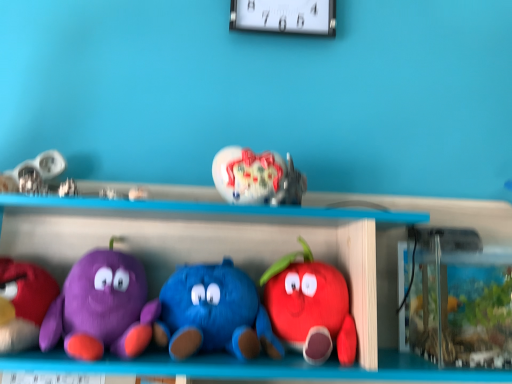
Question: Is purple plush toy at left, which is the 1th toy in left-to-right order, not within matte plush apple at center, the 6th toy from the left?

Choices:
 (A) yes
 (B) no

Answer: (A)

Question: Is purple plush toy at left, marked as the 6th toy in a right-to-left arrangement, wider than matte plush apple at center, the 6th toy from the left?

Choices:
 (A) no
 (B) yes

Answer: (B)

Question: Is purple plush toy at left, which is the 1th toy in left-to-right order, oriented away from matte plush apple at center, the 6th toy from the left?

Choices:
 (A) no
 (B) yes

Answer: (A)

Question: Considering the relative sizes of purple plush toy at left, marked as the 6th toy in a right-to-left arrangement, and matte plush apple at center, the 6th toy from the left, in the image provided, is purple plush toy at left, marked as the 6th toy in a right-to-left arrangement, thinner than matte plush apple at center, the 6th toy from the left,?

Choices:
 (A) no
 (B) yes

Answer: (A)

Question: Does purple plush toy at left, marked as the 6th toy in a right-to-left arrangement, have a greater height compared to matte plush apple at center, the first toy when ordered from right to left?

Choices:
 (A) yes
 (B) no

Answer: (B)

Question: Is purple plush toy at left, marked as the 6th toy in a right-to-left arrangement, not close to matte plush apple at center, the first toy when ordered from right to left?

Choices:
 (A) yes
 (B) no

Answer: (B)

Question: Is white plastic clock at upper center facing towards satin silver toy at upper center, which ranks as the 3th toy in left-to-right order?

Choices:
 (A) no
 (B) yes

Answer: (A)

Question: Is white plastic clock at upper center completely or partially outside of satin silver toy at upper center, which ranks as the 3th toy in left-to-right order?

Choices:
 (A) yes
 (B) no

Answer: (A)

Question: Can you confirm if white plastic clock at upper center is wider than satin silver toy at upper center, which ranks as the 3th toy in left-to-right order?

Choices:
 (A) no
 (B) yes

Answer: (B)

Question: Does white plastic clock at upper center appear on the right side of satin silver toy at upper center, which ranks as the 3th toy in left-to-right order?

Choices:
 (A) no
 (B) yes

Answer: (B)

Question: From the image's perspective, is white plastic clock at upper center located beneath satin silver toy at upper center, which ranks as the 3th toy in left-to-right order?

Choices:
 (A) no
 (B) yes

Answer: (A)

Question: Is white plastic clock at upper center with satin silver toy at upper center, which ranks as the 3th toy in left-to-right order?

Choices:
 (A) no
 (B) yes

Answer: (A)

Question: Can you confirm if matte plush apple at center, the first toy when ordered from right to left, is taller than matte purple plush at left, marked as the 2th toy in a left-to-right arrangement?

Choices:
 (A) no
 (B) yes

Answer: (B)